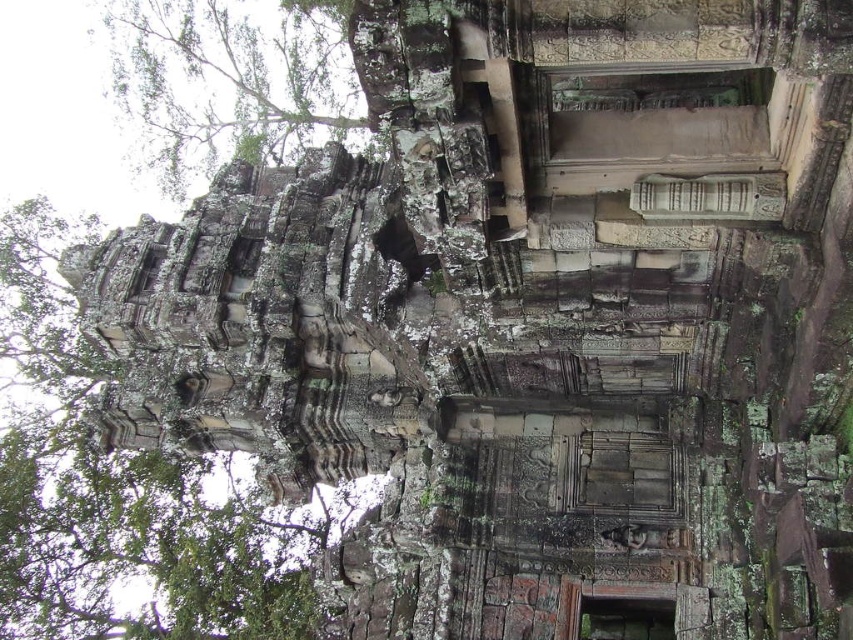
You are an archaeologist examining the ancient stone structure. You notice the green mossy stone tower at left and the green leafy tree at upper left. Which object occupies more horizontal space in the image?

The green mossy stone tower at left might be wider than green leafy tree at upper left.

You are an archaeologist examining the ancient stone structure. You notice the green mossy stone tower at left and the green leafy tree at upper left. Which object is bigger in size?

The green mossy stone tower at left is larger in size compared to the green leafy tree at upper left.

You are a drone operator tasked with capturing aerial footage of the ancient stone structure. Your drone has a maximum flight distance of 12 meters from its starting point. If you position the drone at the green mossy stone tower at left, can it fly to the green leafy tree at upper left without exceeding its range?

The green mossy stone tower at left and green leafy tree at upper left are 12.17 meters apart from each other. Since the drone has a maximum flight distance of 12 meters, it cannot reach the green leafy tree at upper left without exceeding its range.